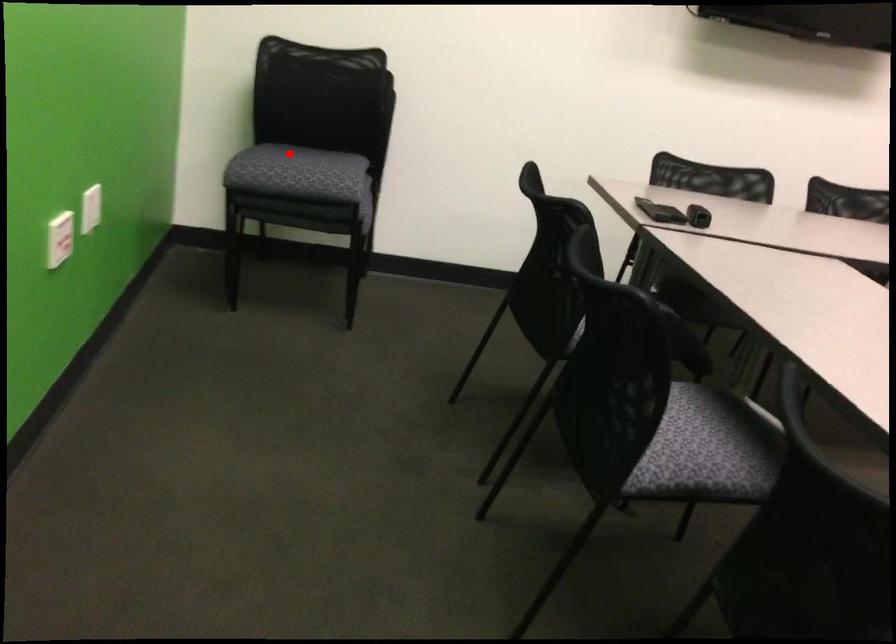
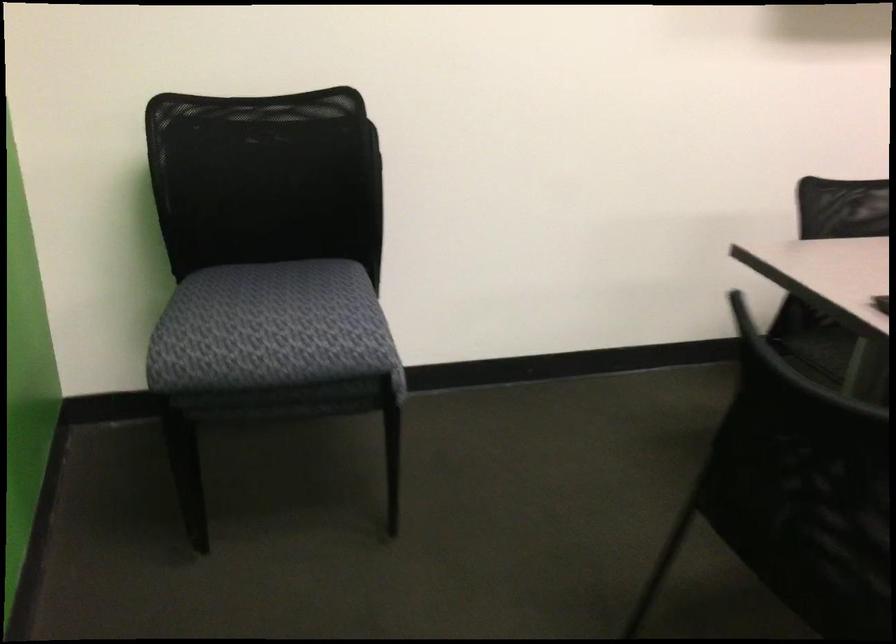
Question: I am providing you with two images of the same scene from different viewpoints. In image1, a red point is highlighted. Considering the same 3D point in image2, which of the following is correct?

Choices:
 (A) It is closer
 (B) It is farther

Answer: (A)